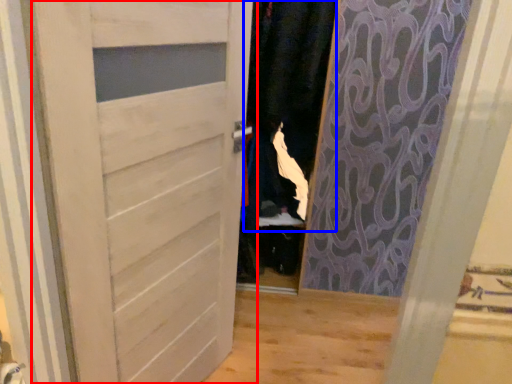
Question: Among these objects, which one is nearest to the camera, door (highlighted by a red box) or clothing (highlighted by a blue box)?

Choices:
 (A) door
 (B) clothing

Answer: (A)